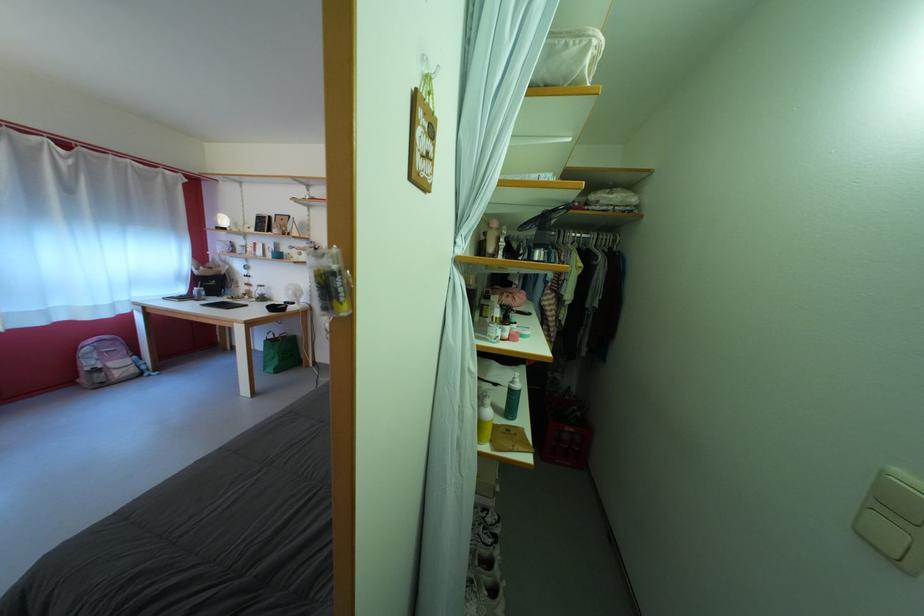
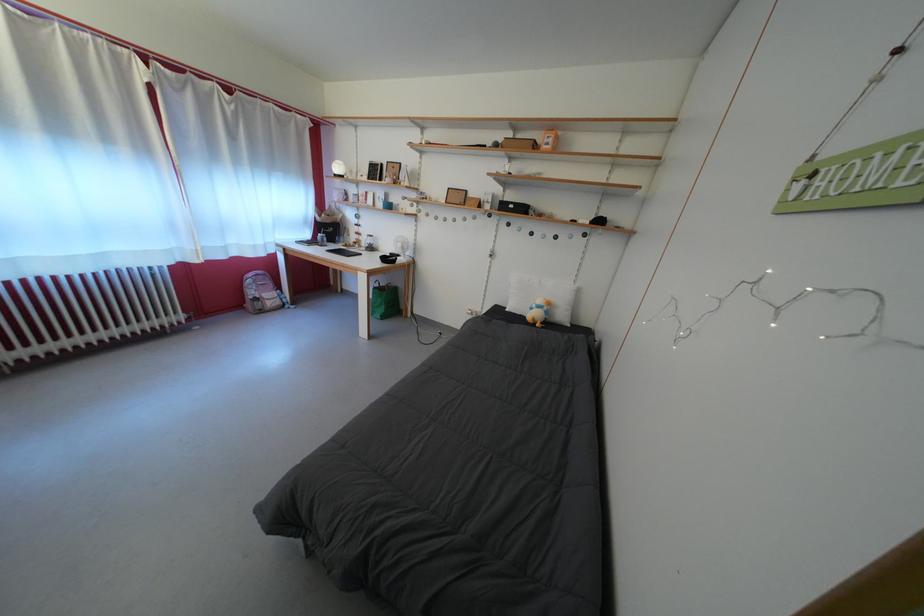
Locate, in the second image, the point that corresponds to pixel 275 346 in the first image.

(383, 294)